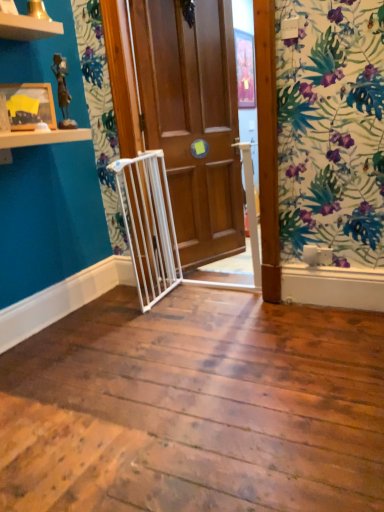
Identify the location of wooden door at center. (193, 120).

Describe the element at coordinates (193, 120) in the screenshot. I see `wooden door at center` at that location.

The image size is (384, 512). In order to click on wooden picture frame at upper left in this screenshot , I will do `click(29, 105)`.

The image size is (384, 512). What do you see at coordinates (29, 105) in the screenshot? I see `wooden picture frame at upper left` at bounding box center [29, 105].

Image resolution: width=384 pixels, height=512 pixels. Identify the location of wooden door at center. (193, 120).

Considering the relative positions of wooden picture frame at upper left and wooden door at center in the image provided, is wooden picture frame at upper left to the right of wooden door at center from the viewer's perspective?

In fact, wooden picture frame at upper left is to the left of wooden door at center.

Looking at this image, between wooden picture frame at upper left and wooden door at center, which one is positioned in front?

Positioned in front is wooden picture frame at upper left.

Does point (13, 87) come behind point (237, 184)?

No, it is not.

From the image's perspective, between wooden picture frame at upper left and wooden door at center, which one is located above?

wooden door at center is shown above in the image.

From a real-world perspective, is wooden picture frame at upper left physically located above or below wooden door at center?

wooden picture frame at upper left is above wooden door at center.

Which of these two, wooden picture frame at upper left or wooden door at center, is wider?

wooden door at center.

Considering the relative sizes of wooden picture frame at upper left and wooden door at center in the image provided, is wooden picture frame at upper left shorter than wooden door at center?

Yes.

Which of these two, wooden picture frame at upper left or wooden door at center, is smaller?

Smaller between the two is wooden picture frame at upper left.

Is wooden door at center completely or partially inside wooden picture frame at upper left?

Definitely not — wooden door at center is not inside wooden picture frame at upper left.

Are wooden picture frame at upper left and wooden door at center located far from each other?

wooden picture frame at upper left is far away from wooden door at center.

Consider the image. Is wooden picture frame at upper left oriented towards wooden door at center?

No.

Can you tell me how much wooden picture frame at upper left and wooden door at center differ in facing direction?

The angle between the facing direction of wooden picture frame at upper left and the facing direction of wooden door at center is 17.6 degrees.

Identify the location of door behind the wooden picture frame at upper left. (193, 120).

Considering the relative positions of wooden door at center and wooden picture frame at upper left in the image provided, is wooden door at center to the left or to the right of wooden picture frame at upper left?

In the image, wooden door at center appears on the right side of wooden picture frame at upper left.

Is the depth of wooden door at center greater than that of wooden picture frame at upper left?

That is True.

Which is closer to the camera, (144, 83) or (21, 104)?

The point (21, 104) is more forward.

From the image's perspective, is wooden door at center beneath wooden picture frame at upper left?

No, from the image's perspective, wooden door at center is not below wooden picture frame at upper left.

From a real-world perspective, which object stands above the other?

wooden picture frame at upper left is physically above.

Which object is thinner, wooden door at center or wooden picture frame at upper left?

With smaller width is wooden picture frame at upper left.

Can you confirm if wooden door at center is taller than wooden picture frame at upper left?

Yes, wooden door at center is taller than wooden picture frame at upper left.

Looking at this image, based on their sizes in the image, would you say wooden door at center is bigger or smaller than wooden picture frame at upper left?

Clearly, wooden door at center is larger in size than wooden picture frame at upper left.

Choose the correct answer: Is wooden door at center inside wooden picture frame at upper left or outside it?

wooden door at center is located beyond the bounds of wooden picture frame at upper left.

Is wooden door at center next to wooden picture frame at upper left?

wooden door at center and wooden picture frame at upper left are clearly separated.

Is wooden door at center oriented away from wooden picture frame at upper left?

wooden door at center does not have its back to wooden picture frame at upper left.

How much distance is there between wooden door at center and wooden picture frame at upper left?

They are 1.06 meters apart.

Locate an element on the screen. The width and height of the screenshot is (384, 512). picture frame that appears in front of the wooden door at center is located at coordinates (29, 105).

Image resolution: width=384 pixels, height=512 pixels. I want to click on door on the right of wooden picture frame at upper left, so click(193, 120).

In the image, there is a wooden door at center. At what (x,y) coordinates should I click in order to perform the action: click on picture frame below it (from the image's perspective). Please return your answer as a coordinate pair (x, y). This screenshot has height=512, width=384. Looking at the image, I should click on (29, 105).